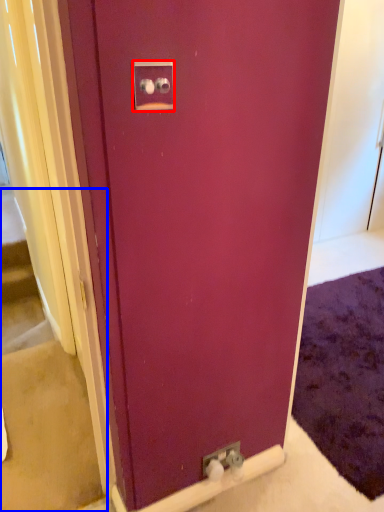
Question: Which object appears closest to the camera in this image, electric outlet (highlighted by a red box) or stairwell (highlighted by a blue box)?

Choices:
 (A) electric outlet
 (B) stairwell

Answer: (A)